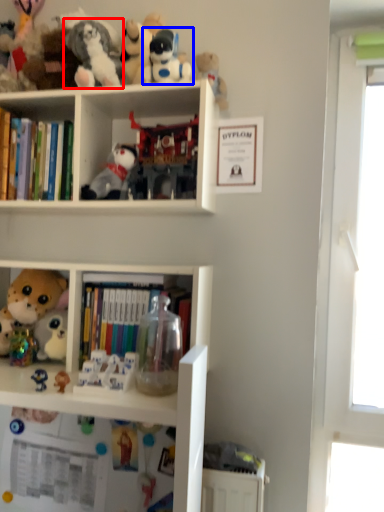
Question: Which object is closer to the camera taking this photo, toy (highlighted by a red box) or toy (highlighted by a blue box)?

Choices:
 (A) toy
 (B) toy

Answer: (A)